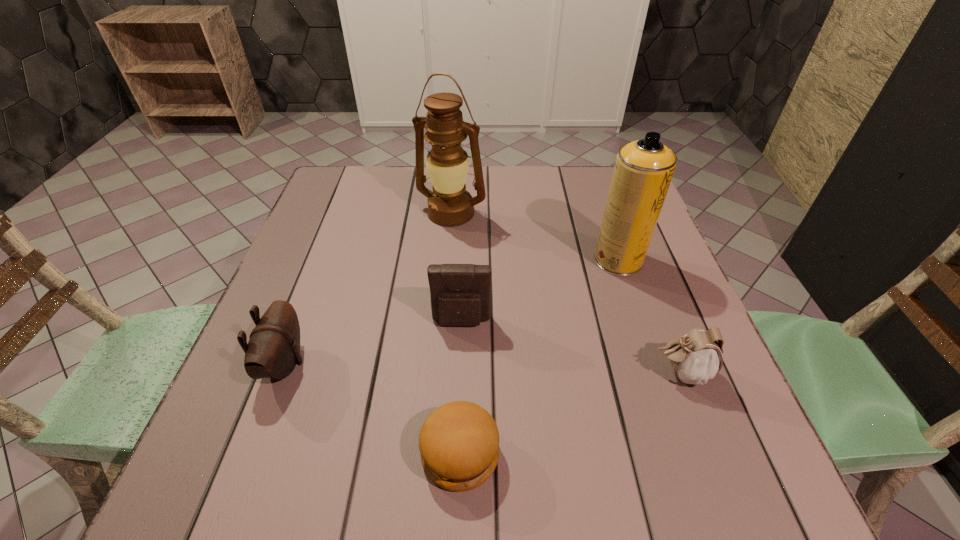
Find the location of a particular element. oil lamp is located at coordinates (450, 204).

You are a GUI agent. You are given a task and a screenshot of the screen. Output one action in this format:
    pyautogui.click(x=<x>, y=<y>)
    Task: Click on the aerosol can
    
    Given the screenshot: What is the action you would take?
    pyautogui.click(x=643, y=170)

Find the location of a particular element. The height and width of the screenshot is (540, 960). the second pouch from left to right is located at coordinates (460, 294).

Locate an element on the screen. Image resolution: width=960 pixels, height=540 pixels. the farthest pouch is located at coordinates (460, 294).

I want to click on the leftmost pouch, so click(273, 350).

You are a GUI agent. You are given a task and a screenshot of the screen. Output one action in this format:
    pyautogui.click(x=<x>, y=<y>)
    Task: Click on the rightmost pouch
    This screenshot has height=540, width=960.
    Given the screenshot: What is the action you would take?
    pyautogui.click(x=696, y=357)

Find the location of a particular element. The height and width of the screenshot is (540, 960). hamburger is located at coordinates (459, 441).

This screenshot has width=960, height=540. I want to click on the nearest object, so click(459, 441).

Locate an element on the screen. vacant space located 0.350m on the right of the farthest object is located at coordinates (613, 213).

The width and height of the screenshot is (960, 540). What are the coordinates of `vacant space positioned on the left of the fifth nearest object` in the screenshot? It's located at point(428,260).